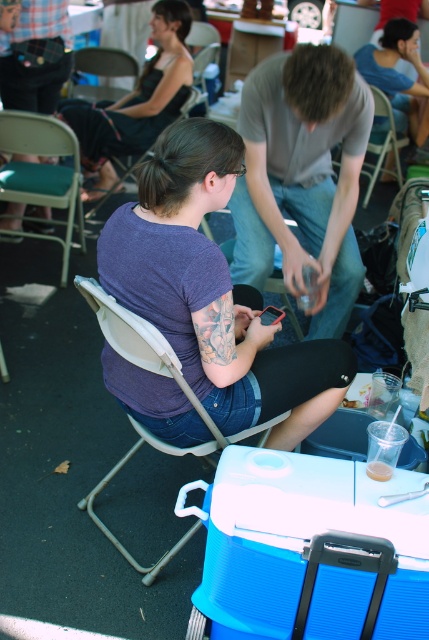
Which of these two, blue plastic cooler at lower right or gray cotton shirt at center, stands taller?

Standing taller between the two is gray cotton shirt at center.

Can you confirm if blue plastic cooler at lower right is positioned to the right of gray cotton shirt at center?

No, blue plastic cooler at lower right is not to the right of gray cotton shirt at center.

Describe the element at coordinates (299, 540) in the screenshot. The width and height of the screenshot is (429, 640). I see `blue plastic cooler at lower right` at that location.

Image resolution: width=429 pixels, height=640 pixels. I want to click on blue plastic cooler at lower right, so click(299, 540).

Between blue plastic cooler at lower right and matte blue shirt at upper center, which one has less height?

Standing shorter between the two is blue plastic cooler at lower right.

Which is more to the left, blue plastic cooler at lower right or matte blue shirt at upper center?

Positioned to the left is blue plastic cooler at lower right.

Identify the location of blue plastic cooler at lower right. (299, 540).

What do you see at coordinates (211, 292) in the screenshot? I see `purple matte shirt at center` at bounding box center [211, 292].

Is purple matte shirt at center shorter than metallic gray chair at upper left?

In fact, purple matte shirt at center may be taller than metallic gray chair at upper left.

Does point (124, 362) come closer to viewer compared to point (111, 49)?

That is True.

Where is `purple matte shirt at center`? This screenshot has height=640, width=429. purple matte shirt at center is located at coordinates (211, 292).